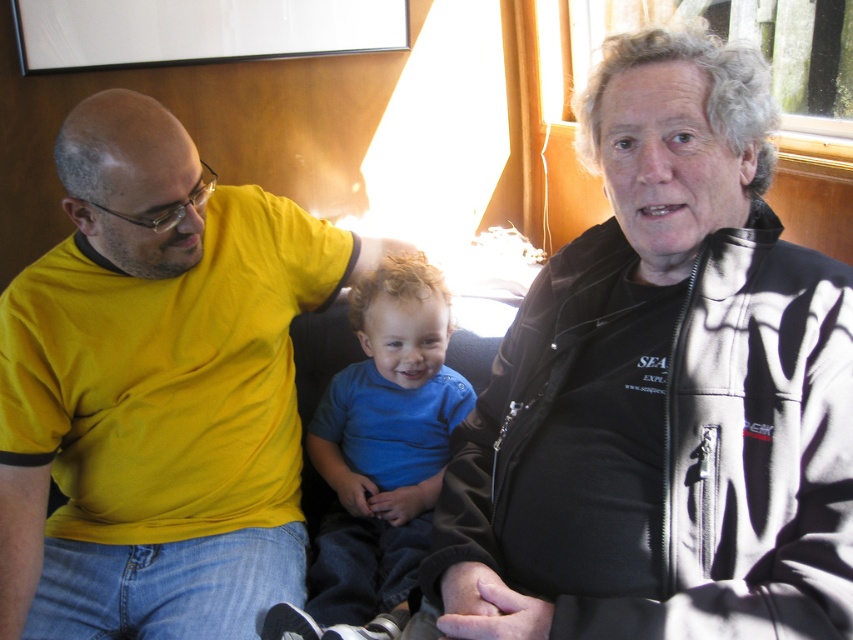
You are standing in the boat cabin and want to determine which of the two points, point (621,54) or point (83,208), is closer to you. Based on the scene description, which point is nearer?

Point (621,54) is closer to the camera than point (83,208), so it is the nearer one.

You are a photographer trying to capture a group photo of the black softshell jacket at upper right and the blue smooth shirt at center. Which of the two is positioned more to the right side?

The black softshell jacket at upper right is positioned on the right side of the blue smooth shirt at center, so it is more to the right side.